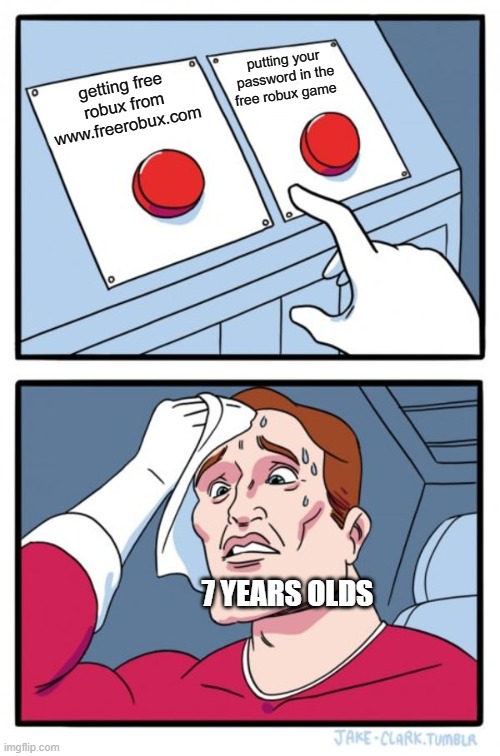
This screenshot has height=756, width=500. What are the coordinates of `back of blue chair` in the screenshot? It's located at (449, 571).